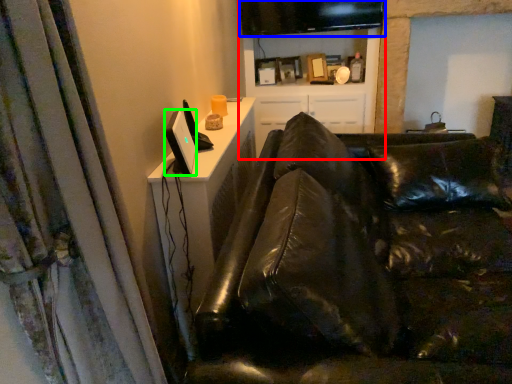
Question: Which object is positioned closest to entertainment center (highlighted by a red box)? Select from computer monitor (highlighted by a blue box) and computer monitor (highlighted by a green box).

Choices:
 (A) computer monitor
 (B) computer monitor

Answer: (A)